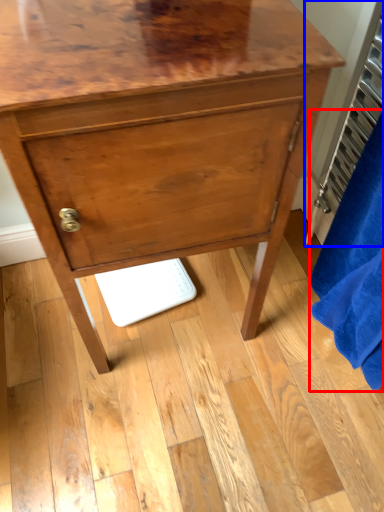
Question: Which of the following is the closest to the observer, bath towel (highlighted by a red box) or radiator (highlighted by a blue box)?

Choices:
 (A) bath towel
 (B) radiator

Answer: (A)